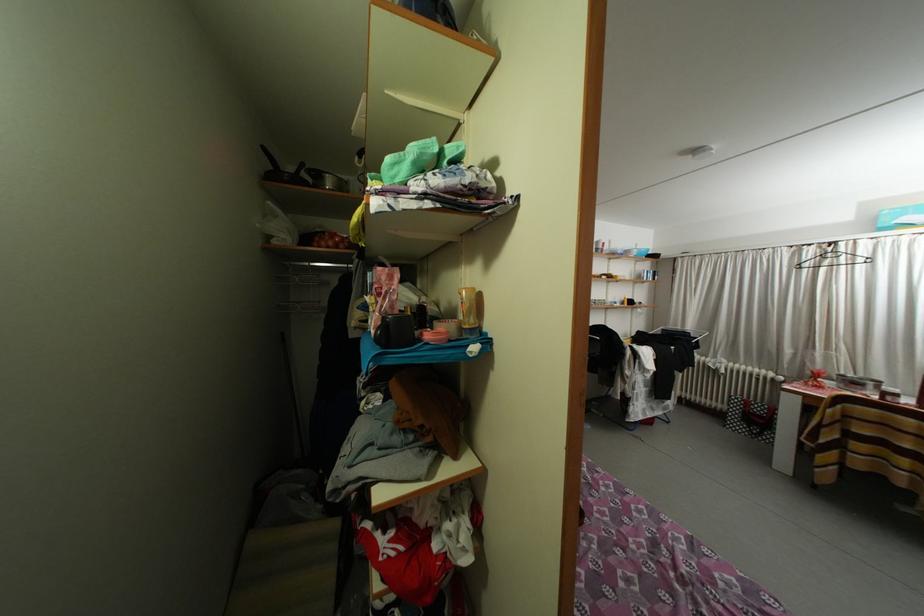
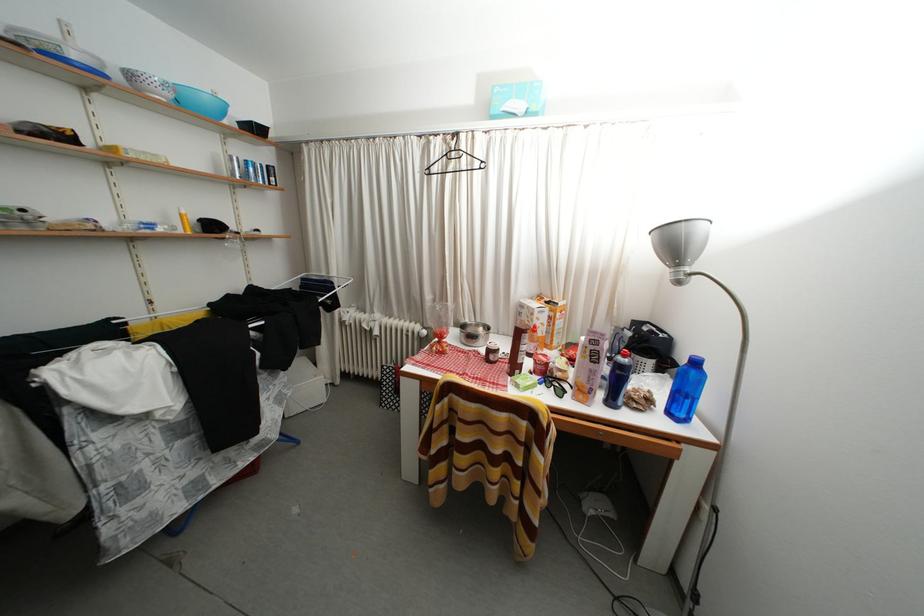
Where in the second image is the point corresponding to pixel 835 387 from the first image?

(460, 342)